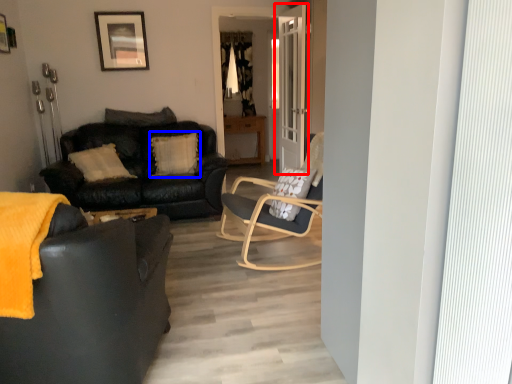
Question: Among these objects, which one is nearest to the camera, door (highlighted by a red box) or pillow (highlighted by a blue box)?

Choices:
 (A) door
 (B) pillow

Answer: (A)